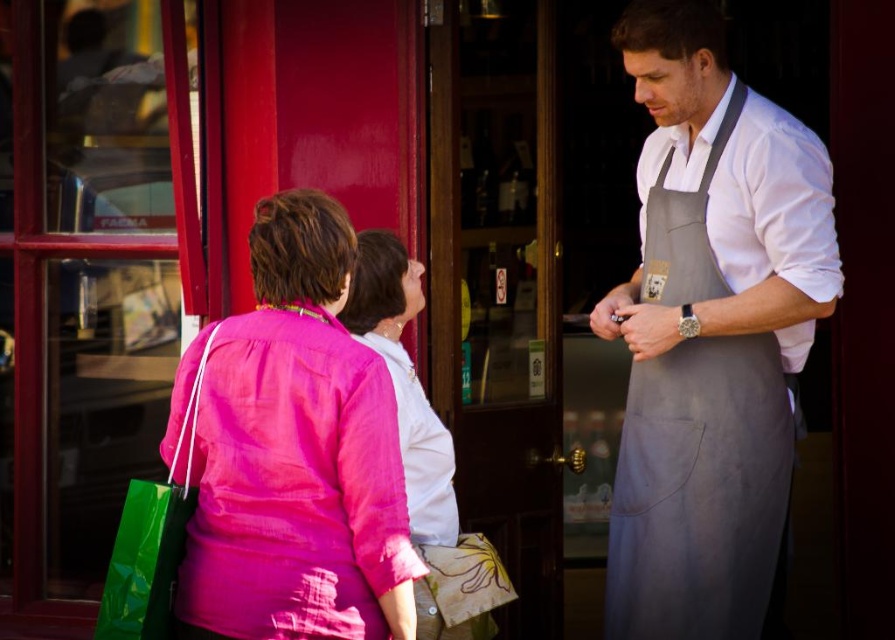
You are a customer entering the shop and notice two items hanging on a rack near the entrance. The gray fabric apron at center and the pink fabric blouse at center. Which item would you need to reach higher to pick up if the apron is hanging above the blouse?

The gray fabric apron at center is bigger than pink fabric blouse at center, so you would need to reach higher to pick up the gray fabric apron at center since it is hanging above the blouse.

You are a customer entering the shop and notice two items hanging on a rack near the entrance. The gray fabric apron at center and the pink fabric shirt at center. Which one is larger in size?

The gray fabric apron at center is bigger than the pink fabric shirt at center, so the gray fabric apron at center is larger in size.